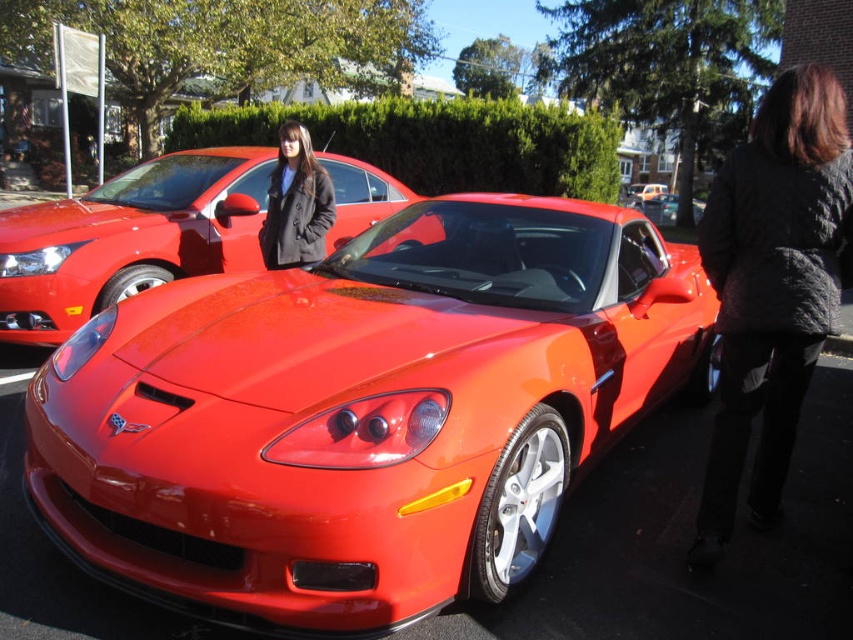
This screenshot has height=640, width=853. Identify the location of glossy red car at center. (659, 209).

Consider the image. Does glossy red car at center lie behind glossy metallic car at center?

No.

Which is in front, point (656, 214) or point (641, 186)?

Point (656, 214)

Identify the location of glossy red car at center. (659, 209).

Is dark gray quilted jacket at right positioned before glossy metallic car at center?

Yes.

Based on the photo, between dark gray quilted jacket at right and glossy metallic car at center, which one has more height?

glossy metallic car at center

The height and width of the screenshot is (640, 853). What are the coordinates of `dark gray quilted jacket at right` in the screenshot? It's located at (772, 285).

Who is shorter, dark gray quilted jacket at right or shiny red sports car at center?

dark gray quilted jacket at right is shorter.

Between dark gray quilted jacket at right and shiny red sports car at center, which one has more height?

shiny red sports car at center is taller.

Is point (706, 268) positioned before point (96, 304)?

Yes, it is.

You are a GUI agent. You are given a task and a screenshot of the screen. Output one action in this format:
    pyautogui.click(x=<x>, y=<y>)
    Task: Click on the dark gray quilted jacket at right
    The image size is (853, 640).
    Given the screenshot: What is the action you would take?
    pyautogui.click(x=772, y=285)